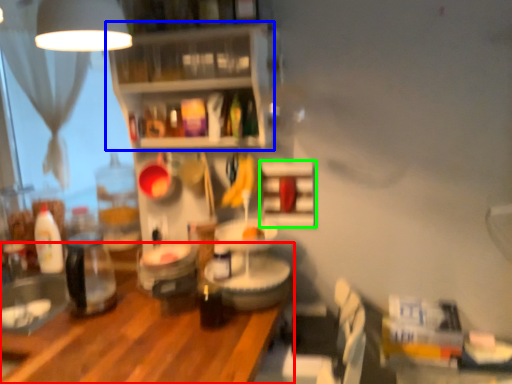
Question: Based on their relative distances, which object is farther from table (highlighted by a red box)? Choose from shelf (highlighted by a blue box) and shelf (highlighted by a green box).

Choices:
 (A) shelf
 (B) shelf

Answer: (A)